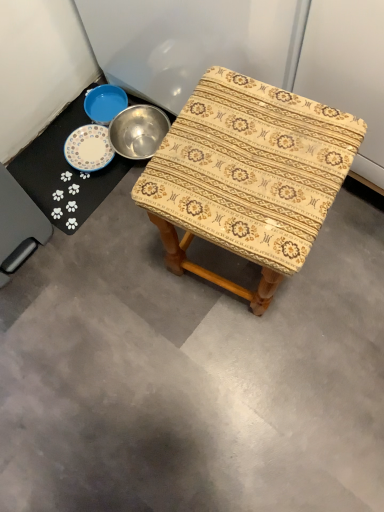
Question: From the image's perspective, is white glossy plate at upper left on patterned fabric stool at center?

Choices:
 (A) no
 (B) yes

Answer: (B)

Question: Does white glossy plate at upper left have a lesser height compared to patterned fabric stool at center?

Choices:
 (A) yes
 (B) no

Answer: (A)

Question: Considering the relative sizes of white glossy plate at upper left and patterned fabric stool at center in the image provided, is white glossy plate at upper left wider than patterned fabric stool at center?

Choices:
 (A) no
 (B) yes

Answer: (A)

Question: From a real-world perspective, is white glossy plate at upper left below patterned fabric stool at center?

Choices:
 (A) yes
 (B) no

Answer: (A)

Question: From a real-world perspective, does white glossy plate at upper left stand above patterned fabric stool at center?

Choices:
 (A) no
 (B) yes

Answer: (A)

Question: Would you say patterned fabric stool at center is part of white glossy plate at upper left's contents?

Choices:
 (A) yes
 (B) no

Answer: (B)

Question: Is patterned fabric stool at center oriented towards white glossy plate at upper left?

Choices:
 (A) no
 (B) yes

Answer: (A)

Question: Does patterned fabric stool at center have a greater width compared to white glossy plate at upper left?

Choices:
 (A) no
 (B) yes

Answer: (B)

Question: Is patterned fabric stool at center shorter than white glossy plate at upper left?

Choices:
 (A) no
 (B) yes

Answer: (A)

Question: Considering the relative positions of patterned fabric stool at center and white glossy plate at upper left in the image provided, is patterned fabric stool at center to the right of white glossy plate at upper left from the viewer's perspective?

Choices:
 (A) yes
 (B) no

Answer: (A)

Question: Is patterned fabric stool at center turned away from white glossy plate at upper left?

Choices:
 (A) no
 (B) yes

Answer: (A)

Question: From a real-world perspective, does patterned fabric stool at center stand above white glossy plate at upper left?

Choices:
 (A) yes
 (B) no

Answer: (A)

Question: In terms of height, does white glossy plate at upper left look taller or shorter compared to patterned fabric stool at center?

Choices:
 (A) short
 (B) tall

Answer: (A)